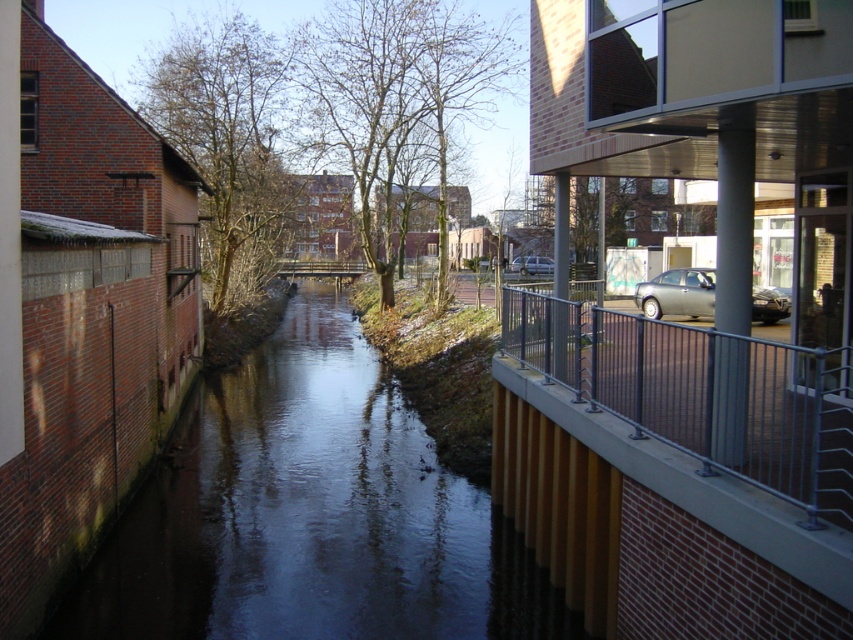
You are a bird flying over the canal and want to land on the dark water at center or the bare branches at center. Which surface would you choose if you prefer a larger area to land?

The bare branches at center have a larger size than the dark water at center, so you should choose the bare branches at center for landing.

You are an urban planner assessing the canal area. You notice the bare branches at center and the brown leafy tree at upper left. Which tree feature is bigger in size?

The bare branches at center is larger in size than the brown leafy tree at upper left.